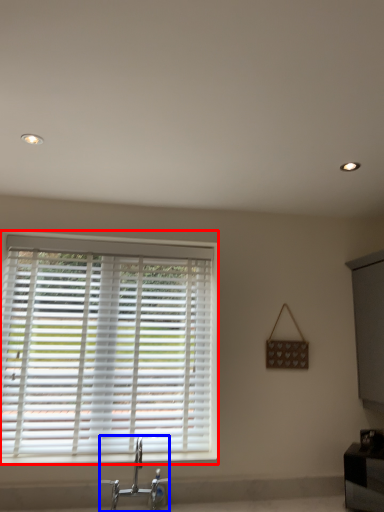
Question: Among these objects, which one is farthest to the camera, window blind (highlighted by a red box) or tap (highlighted by a blue box)?

Choices:
 (A) window blind
 (B) tap

Answer: (A)